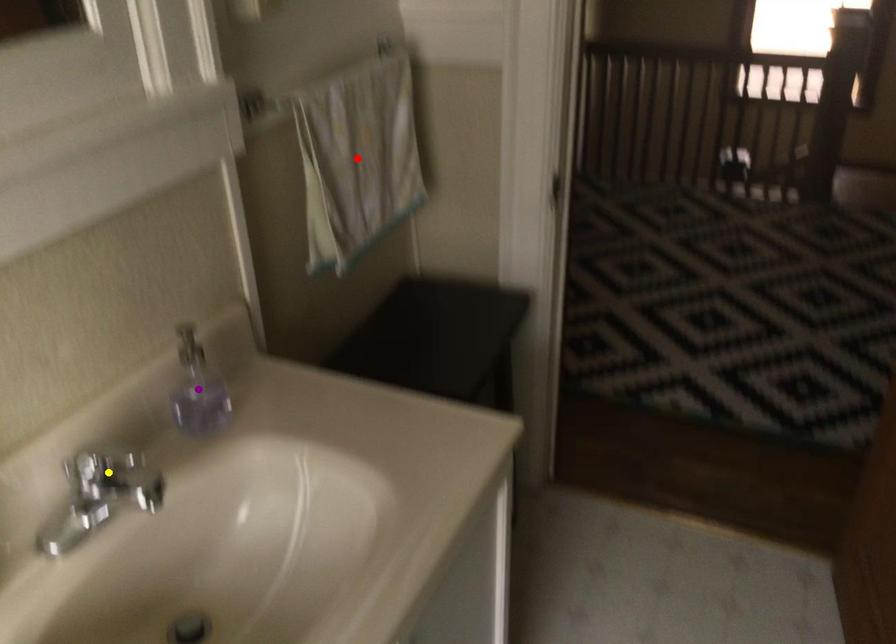
Order these from farthest to nearest:
- red point
- yellow point
- purple point

red point
purple point
yellow point